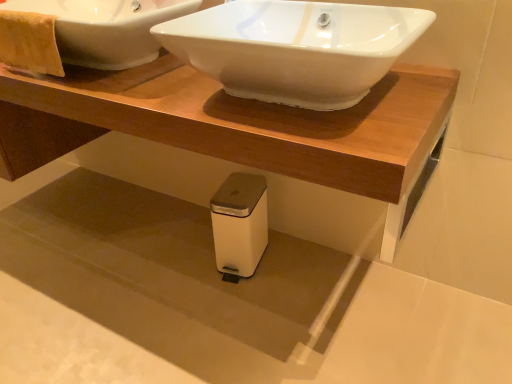
Locate an element on the screen. vacant space to the right of white matte trash can at lower center is located at coordinates (302, 268).